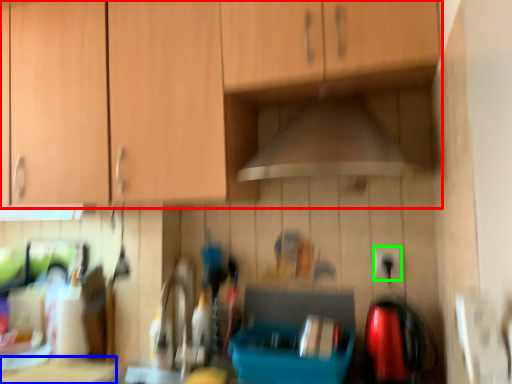
Question: Considering the real-world distances, which object is closest to cabinetry (highlighted by a red box)? counter top (highlighted by a blue box) or electric outlet (highlighted by a green box).

Choices:
 (A) counter top
 (B) electric outlet

Answer: (B)